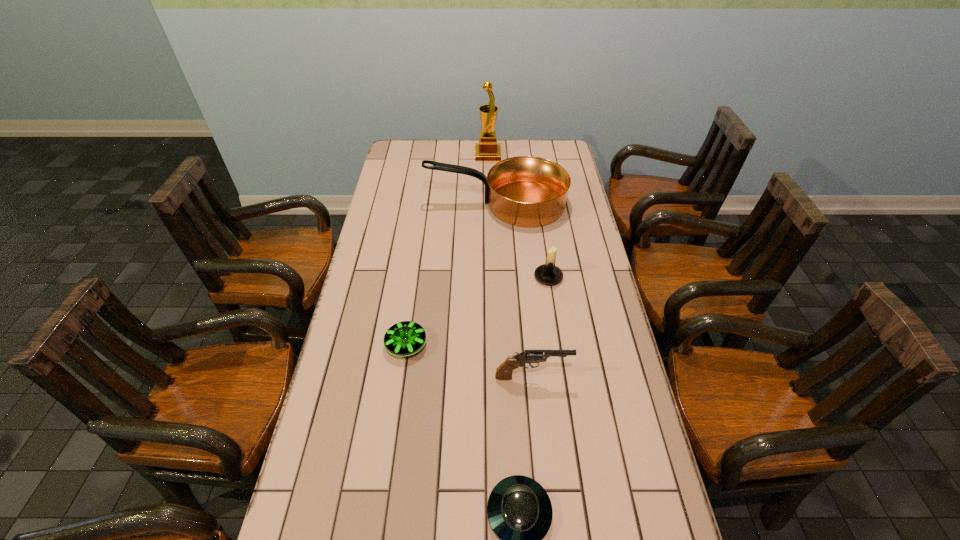
Find the location of a particular element. Image resolution: width=960 pixels, height=540 pixels. vacant space located 0.170m on the front-facing side of the tallest object is located at coordinates (439, 155).

You are a GUI agent. You are given a task and a screenshot of the screen. Output one action in this format:
    pyautogui.click(x=<x>, y=<y>)
    Task: Click on the vacant region located on the front-facing side of the tallest object
    The height and width of the screenshot is (540, 960).
    Given the screenshot: What is the action you would take?
    pyautogui.click(x=452, y=155)

Where is `vacant space located on the front-facing side of the tallest object`? The width and height of the screenshot is (960, 540). vacant space located on the front-facing side of the tallest object is located at coordinates (422, 155).

The width and height of the screenshot is (960, 540). What are the coordinates of `blank area located on the handle side of the fifth nearest object` in the screenshot? It's located at (377, 204).

Find the location of a particular element. The height and width of the screenshot is (540, 960). free region located on the handle side of the fifth nearest object is located at coordinates (395, 204).

Where is `vacant space located 0.120m on the handle side of the fifth nearest object`? The width and height of the screenshot is (960, 540). vacant space located 0.120m on the handle side of the fifth nearest object is located at coordinates (396, 204).

The height and width of the screenshot is (540, 960). In order to click on vacant space located 0.390m on the back of the candle holder in this screenshot , I will do `click(537, 201)`.

Identify the location of blank area located 0.050m along the barrel of the second nearest object. The image size is (960, 540). (588, 376).

The width and height of the screenshot is (960, 540). Identify the location of vacant position located on the front of the fifth tallest object. (394, 436).

Where is `object positioned at the far edge`? This screenshot has height=540, width=960. object positioned at the far edge is located at coordinates click(487, 149).